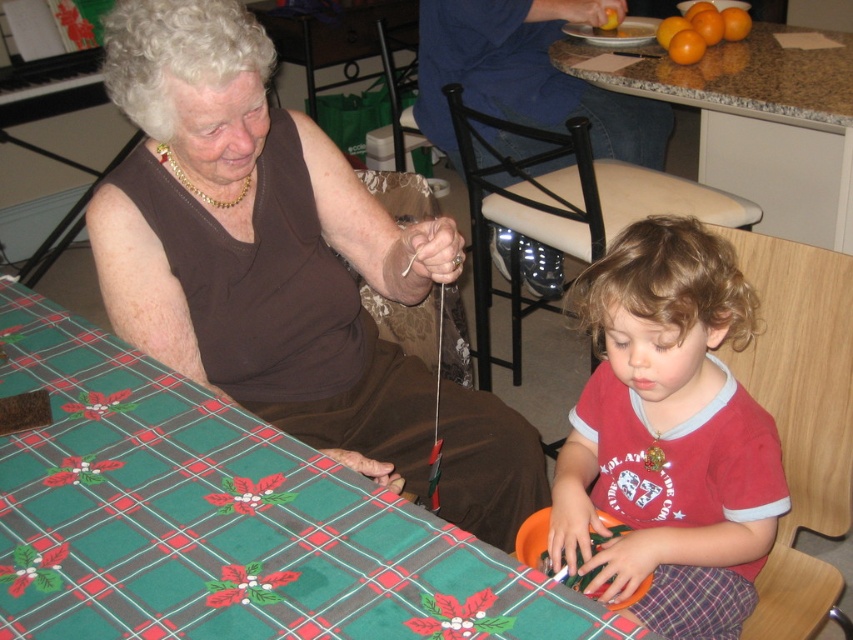
Question: Which point is closer to the camera?

Choices:
 (A) (376, 237)
 (B) (813, 172)

Answer: (A)

Question: Which object is closer to the camera taking this photo?

Choices:
 (A) red cotton shirt at lower right
 (B) brown fabric at upper left
 (C) green plaid tablecloth at lower left

Answer: (C)

Question: Which object is farther from the camera taking this photo?

Choices:
 (A) granite countertop at upper right
 (B) green plaid tablecloth at lower left
 (C) red cotton shirt at lower right
 (D) brown fabric at upper left

Answer: (A)

Question: Is red cotton shirt at lower right to the left of granite countertop at upper right from the viewer's perspective?

Choices:
 (A) no
 (B) yes

Answer: (B)

Question: Observing the image, what is the correct spatial positioning of brown fabric at upper left in reference to granite countertop at upper right?

Choices:
 (A) above
 (B) below

Answer: (B)

Question: Is brown fabric at upper left thinner than red cotton shirt at lower right?

Choices:
 (A) no
 (B) yes

Answer: (A)